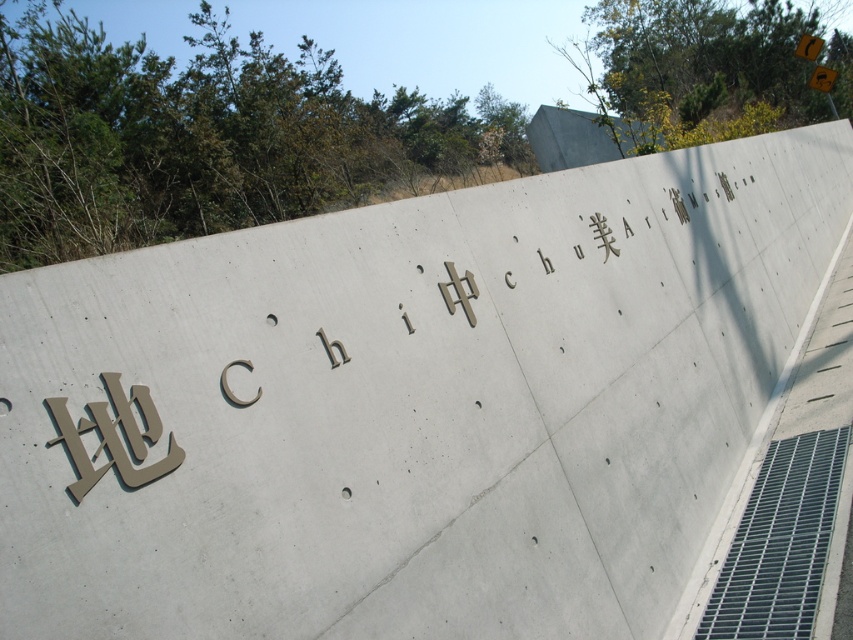
Consider the image. You are standing in front of the concrete wall with engraved text. There is a yellow reflective plastic at upper right. Where exactly is the yellow reflective plastic located in terms of coordinates?

The yellow reflective plastic at upper right is located at coordinates point (822, 77).